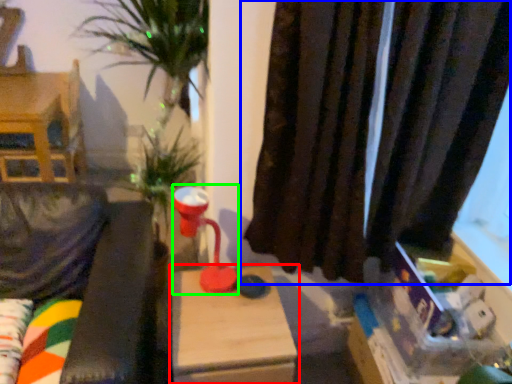
Question: Which is farther away from table (highlighted by a red box)? curtain (highlighted by a blue box) or table lamp (highlighted by a green box)?

Choices:
 (A) curtain
 (B) table lamp

Answer: (A)